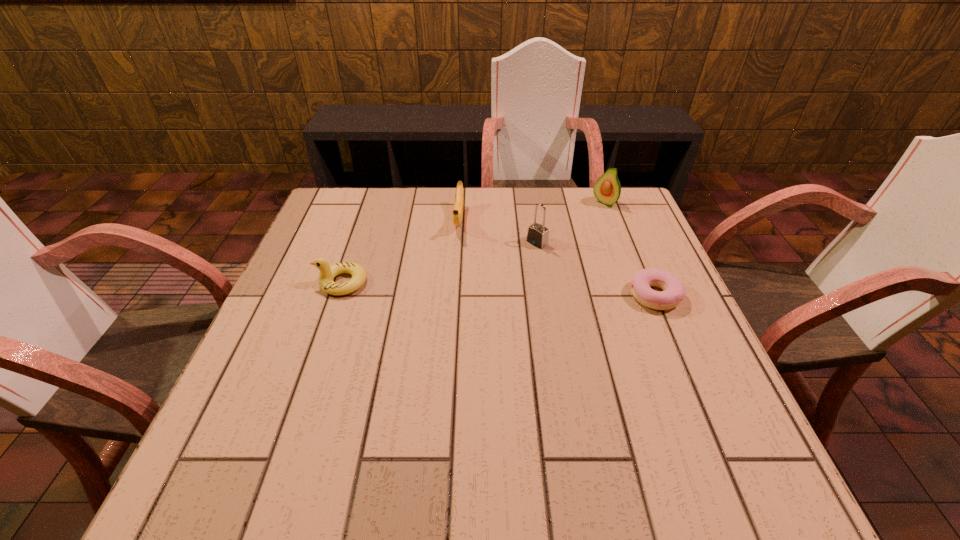
Find the location of a particular element. free space between the doughnut and the third object from right to left is located at coordinates (596, 269).

You are a GUI agent. You are given a task and a screenshot of the screen. Output one action in this format:
    pyautogui.click(x=<x>, y=<y>)
    Task: Click on the free space between the banana and the third object from right to left
    The image size is (960, 540).
    Given the screenshot: What is the action you would take?
    pyautogui.click(x=498, y=231)

This screenshot has width=960, height=540. In order to click on free space between the third object from right to left and the second shortest object in this screenshot , I will do `click(440, 262)`.

In order to click on vacant space that is in between the padlock and the duckling in this screenshot , I will do `click(440, 262)`.

Where is `empty location between the leftmost object and the padlock`? empty location between the leftmost object and the padlock is located at coordinates (440, 262).

Where is `free space between the second object from left to right and the leftmost object`? free space between the second object from left to right and the leftmost object is located at coordinates (400, 251).

The image size is (960, 540). In order to click on free space between the third shortest object and the leftmost object in this screenshot , I will do `click(400, 251)`.

This screenshot has height=540, width=960. I want to click on blank region between the shortest object and the padlock, so click(x=596, y=269).

Locate an element on the screen. empty location between the padlock and the avocado is located at coordinates (571, 223).

Image resolution: width=960 pixels, height=540 pixels. Identify the location of object that stands as the closest to the fourth object from right to left. (538, 235).